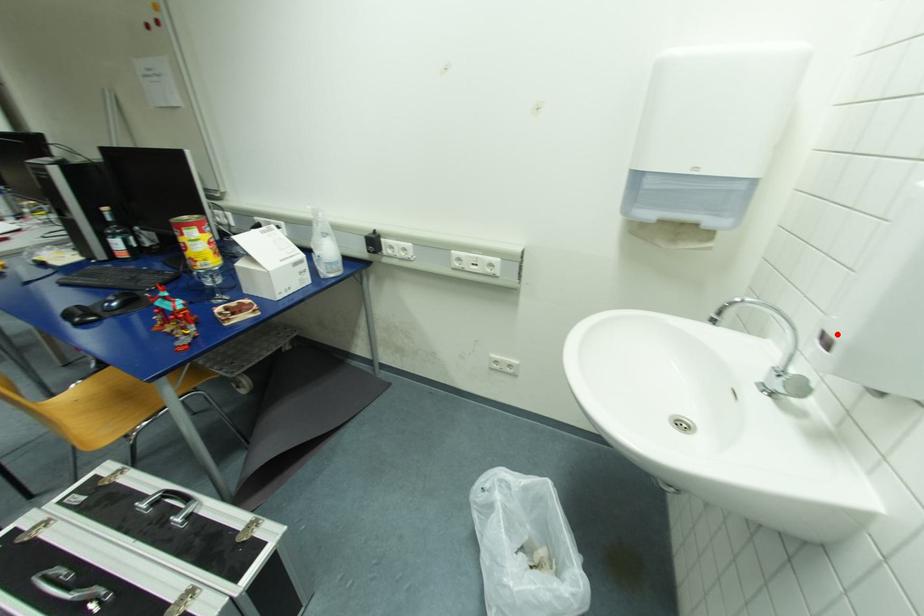
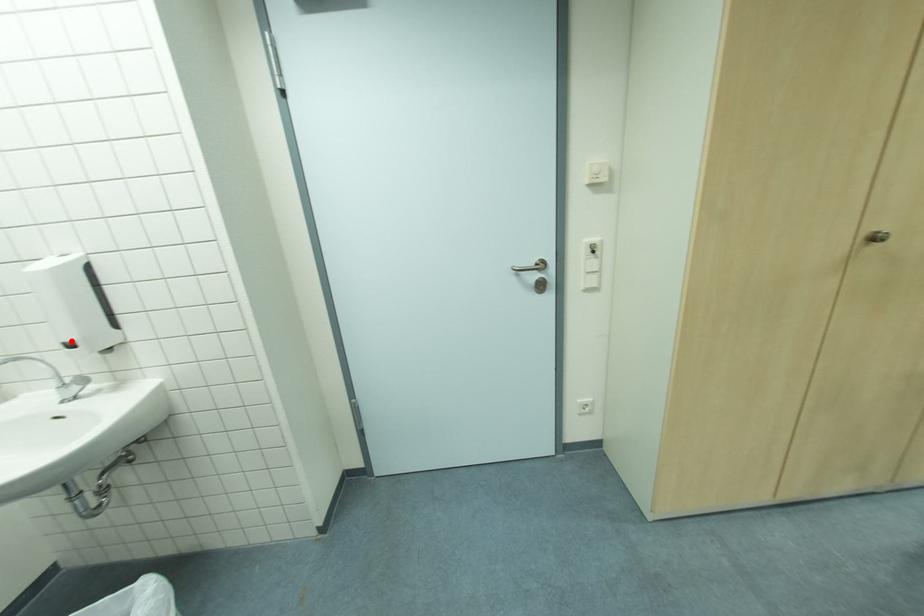
I am providing you with two images of the same scene from different viewpoints. A red point is marked on the first image and another point is marked on the second image. Are the points marked in image1 and image2 representing the same 3D position?

Yes